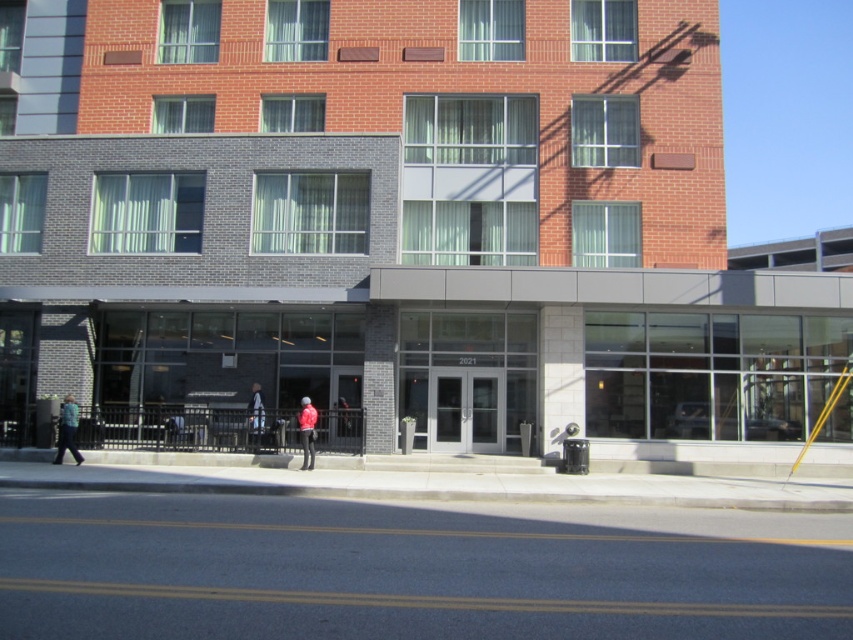
Can you confirm if green fabric jacket at lower left is thinner than red matte jacket at center?

Incorrect, green fabric jacket at lower left's width is not less than red matte jacket at center's.

Identify the location of green fabric jacket at lower left. (67, 429).

What do you see at coordinates (67, 429) in the screenshot? The image size is (853, 640). I see `green fabric jacket at lower left` at bounding box center [67, 429].

Image resolution: width=853 pixels, height=640 pixels. Find the location of `green fabric jacket at lower left`. green fabric jacket at lower left is located at coordinates (67, 429).

Is red matte jacket at center taller than light blue fabric jacket at center?

Indeed, red matte jacket at center has a greater height compared to light blue fabric jacket at center.

Is point (303, 452) closer to camera compared to point (254, 401)?

Yes.

Locate an element on the screen. red matte jacket at center is located at coordinates (306, 432).

From the picture: Does green fabric jacket at lower left have a larger size compared to light blue fabric jacket at center?

Yes, green fabric jacket at lower left is bigger than light blue fabric jacket at center.

Does green fabric jacket at lower left appear on the right side of light blue fabric jacket at center?

Incorrect, green fabric jacket at lower left is not on the right side of light blue fabric jacket at center.

Which is in front, point (61, 449) or point (257, 408)?

Point (61, 449) is in front.

At what (x,y) coordinates should I click in order to perform the action: click on green fabric jacket at lower left. Please return your answer as a coordinate pair (x, y). The image size is (853, 640). Looking at the image, I should click on (67, 429).